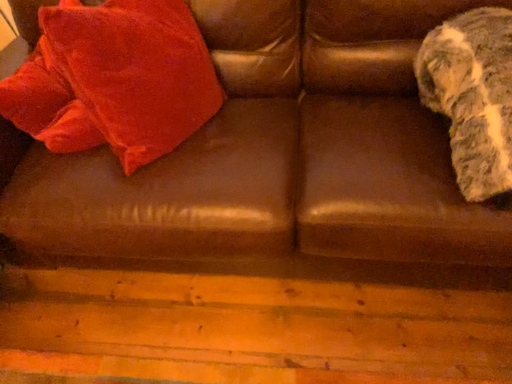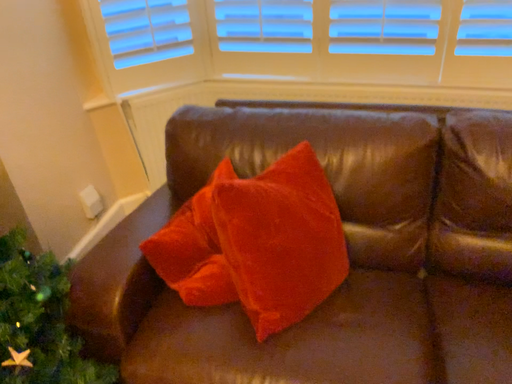
Question: How did the camera likely rotate when shooting the video?

Choices:
 (A) rotated downward
 (B) rotated upward

Answer: (B)